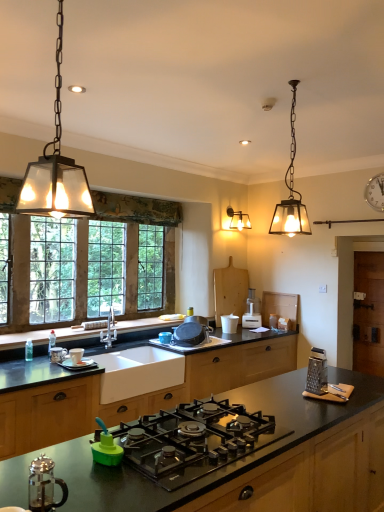
In order to click on blank space above matte glass pendant light at upper right, arranged as the 2th lamp when viewed from the front (from a real-world perspective) in this screenshot , I will do `click(291, 82)`.